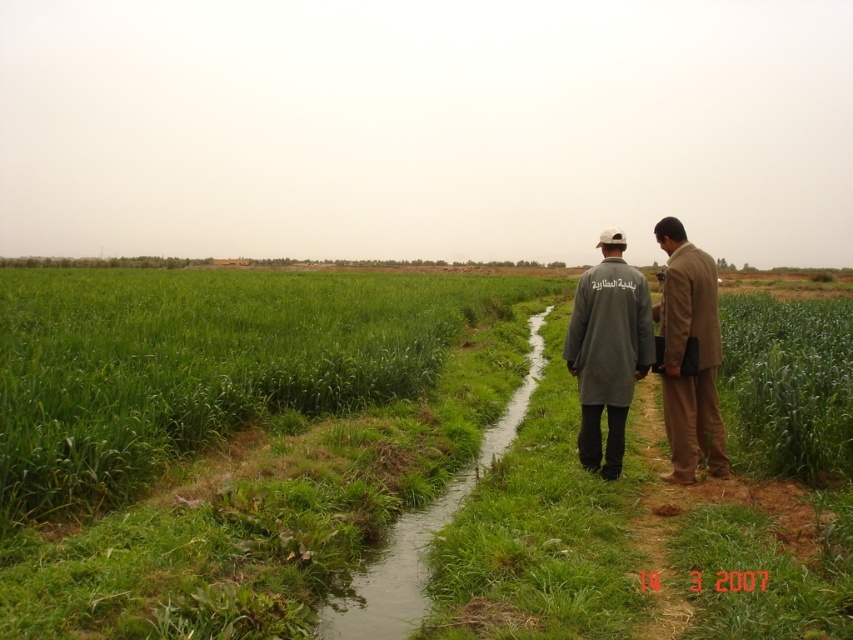
Can you confirm if green grass at center is positioned above green grassy path at center?

Indeed, green grass at center is positioned over green grassy path at center.

Between green grass at center and green grassy path at center, which one is positioned lower?

green grassy path at center is lower down.

This screenshot has height=640, width=853. Describe the element at coordinates (228, 433) in the screenshot. I see `green grass at center` at that location.

Identify the location of green grass at center. (228, 433).

Who is more forward, [518,372] or [670,227]?

Point [670,227]

In the scene shown: Who is more distant from viewer, (158, 305) or (683, 280)?

The point (158, 305) is behind.

Is point (96, 502) positioned after point (668, 380)?

No, (96, 502) is closer to viewer.

The width and height of the screenshot is (853, 640). In order to click on green grass at center in this screenshot , I will do `click(228, 433)`.

Who is more distant from viewer, (x=374, y=620) or (x=693, y=308)?

Positioned behind is point (x=693, y=308).

This screenshot has height=640, width=853. Identify the location of green grassy path at center. (421, 532).